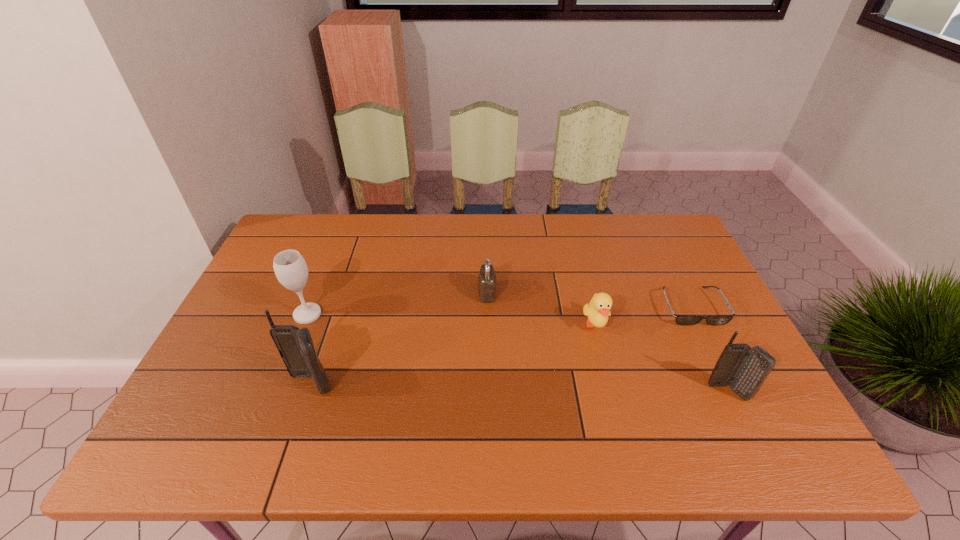
Image resolution: width=960 pixels, height=540 pixels. What are the coordinates of `the left cellular telephone` in the screenshot? It's located at (295, 346).

The width and height of the screenshot is (960, 540). In order to click on the right cellular telephone in this screenshot , I will do [x=744, y=368].

Find the location of a particular element. This screenshot has height=540, width=960. duckling is located at coordinates (598, 309).

The width and height of the screenshot is (960, 540). What are the coordinates of `wineglass` in the screenshot? It's located at (290, 268).

Where is `the fourth object from right to left`? the fourth object from right to left is located at coordinates (487, 278).

In order to click on sunglasses in this screenshot , I will do point(715,320).

I want to click on free space located on the front-facing side of the third object from right to left, so click(x=614, y=396).

Identify the location of vacant space positioned on the back of the wineglass. (324, 272).

Identify the location of vacant region located 0.300m at the front of the padlock near the keyhole. The width and height of the screenshot is (960, 540). 375,293.

Locate an element on the screen. This screenshot has width=960, height=540. vacant region located 0.070m at the front of the padlock near the keyhole is located at coordinates (454, 293).